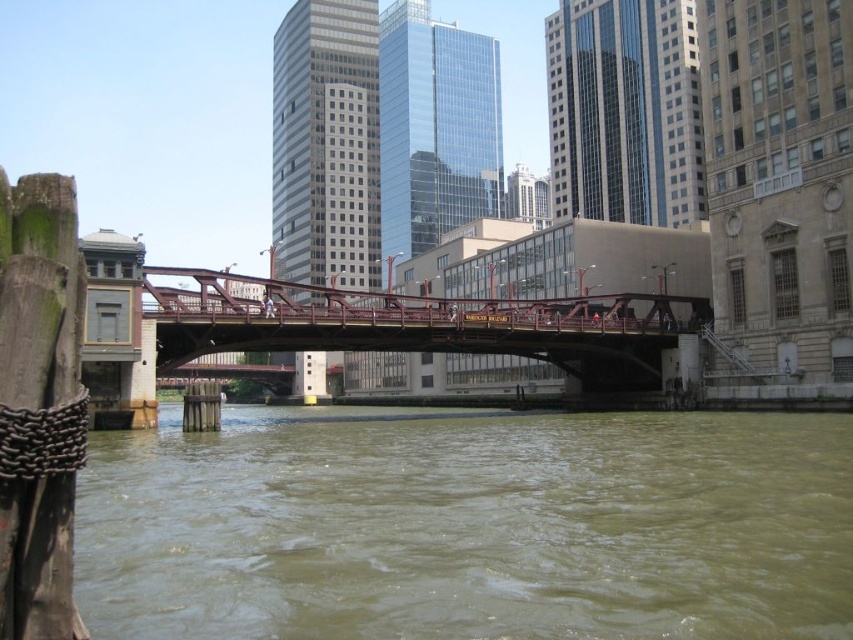
Question: Is brown murky water at center thinner than rusty metal bridge at center?

Choices:
 (A) no
 (B) yes

Answer: (A)

Question: Can you confirm if brown murky water at center is thinner than rusty metal bridge at center?

Choices:
 (A) no
 (B) yes

Answer: (A)

Question: Which of the following is the closest to the observer?

Choices:
 (A) brown murky water at center
 (B) rusty metal bridge at center

Answer: (A)

Question: Is brown murky water at center below rusty metal bridge at center?

Choices:
 (A) no
 (B) yes

Answer: (B)